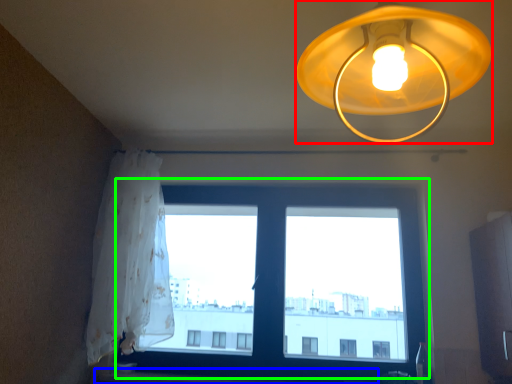
Question: Based on their relative distances, which object is farther from lamp (highlighted by a red box)? Choose from window sill (highlighted by a blue box) and window (highlighted by a green box).

Choices:
 (A) window sill
 (B) window

Answer: (A)